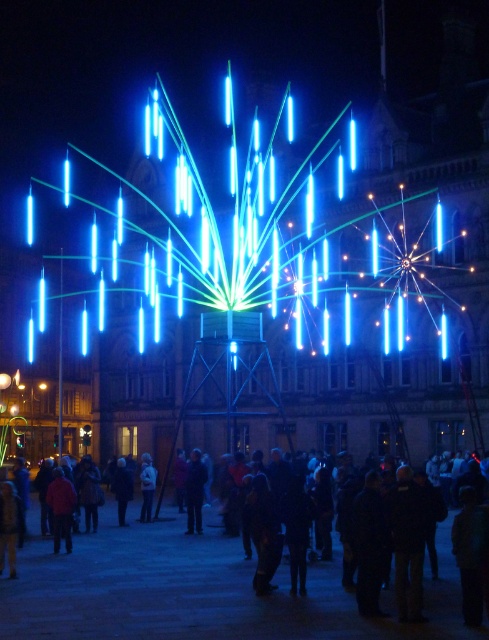
Question: Among these objects, which one is farthest from the camera?

Choices:
 (A) dark blue fabric coat at lower center
 (B) dark clothing crowd at center
 (C) blue glass tubes at center
 (D) red fabric jacket at lower left

Answer: (A)

Question: Is dark blue fabric jacket at center below dark blue fabric coat at lower center?

Choices:
 (A) no
 (B) yes

Answer: (A)

Question: Can you confirm if blue glass tubes at center is positioned below dark clothing crowd at center?

Choices:
 (A) no
 (B) yes

Answer: (A)

Question: Does blue glass tubes at center lie in front of dark blue fabric coat at lower center?

Choices:
 (A) no
 (B) yes

Answer: (B)

Question: Which object appears closest to the camera in this image?

Choices:
 (A) dark blue fabric coat at lower center
 (B) white matte jacket at center
 (C) red fabric jacket at lower left

Answer: (C)

Question: Which of the following is the closest to the observer?

Choices:
 (A) dark blue fabric coat at lower center
 (B) red fabric jacket at lower left

Answer: (B)